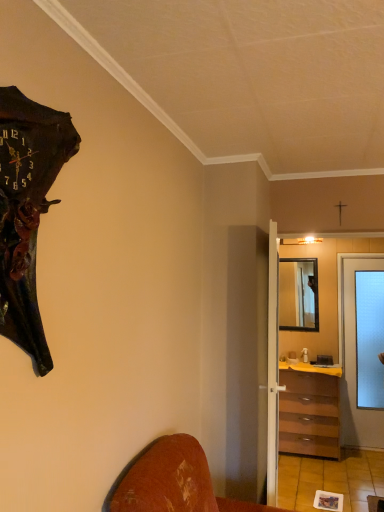
Question: Does point (286, 364) appear closer or farther from the camera than point (283, 303)?

Choices:
 (A) farther
 (B) closer

Answer: (B)

Question: From their relative heights in the image, would you say yellow laminate counter top at center is taller or shorter than wooden framed mirror at center?

Choices:
 (A) tall
 (B) short

Answer: (B)

Question: Which is farther from the transparent glass door at right, which appears as the 2th door when viewed from the left?

Choices:
 (A) yellow laminate counter top at center
 (B) transparent frosted glass screen door at center-right
 (C) dark brown wooden wall clock at left
 (D) wooden framed mirror at center
 (E) white wooden door at center, placed as the first door when sorted from front to back

Answer: (C)

Question: Based on their relative distances, which object is farther from the wooden framed mirror at center?

Choices:
 (A) transparent glass door at right, which is the second door in front-to-back order
 (B) dark brown wooden wall clock at left
 (C) white wooden door at center, placed as the first door when sorted from front to back
 (D) transparent frosted glass screen door at center-right
 (E) brown wooden chest of drawers at center-right

Answer: (B)